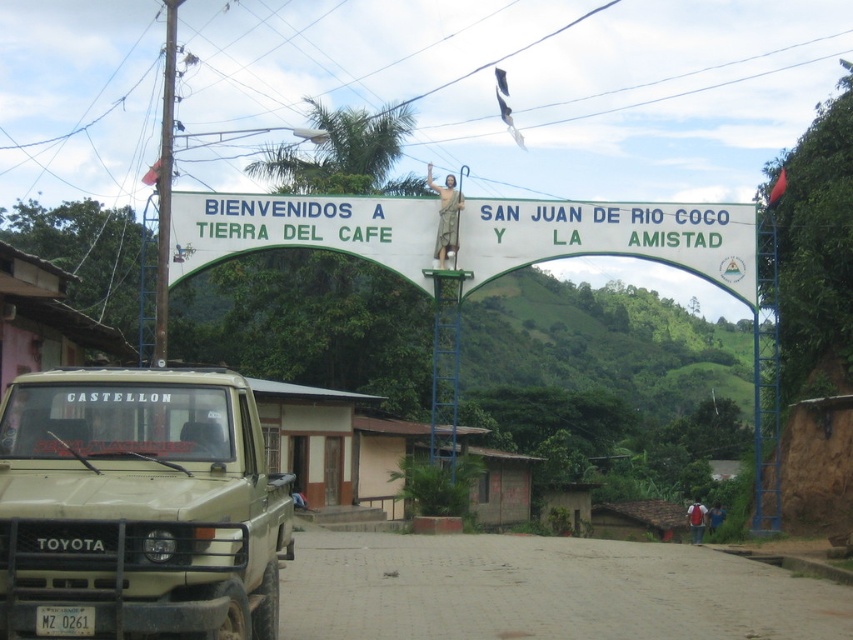
Is beige matte truck at lower left below white painted wood sign at center?

Yes.

The height and width of the screenshot is (640, 853). What do you see at coordinates (137, 506) in the screenshot?
I see `beige matte truck at lower left` at bounding box center [137, 506].

You are a GUI agent. You are given a task and a screenshot of the screen. Output one action in this format:
    pyautogui.click(x=<x>, y=<y>)
    Task: Click on the beige matte truck at lower left
    Image resolution: width=853 pixels, height=640 pixels.
    Given the screenshot: What is the action you would take?
    pyautogui.click(x=137, y=506)